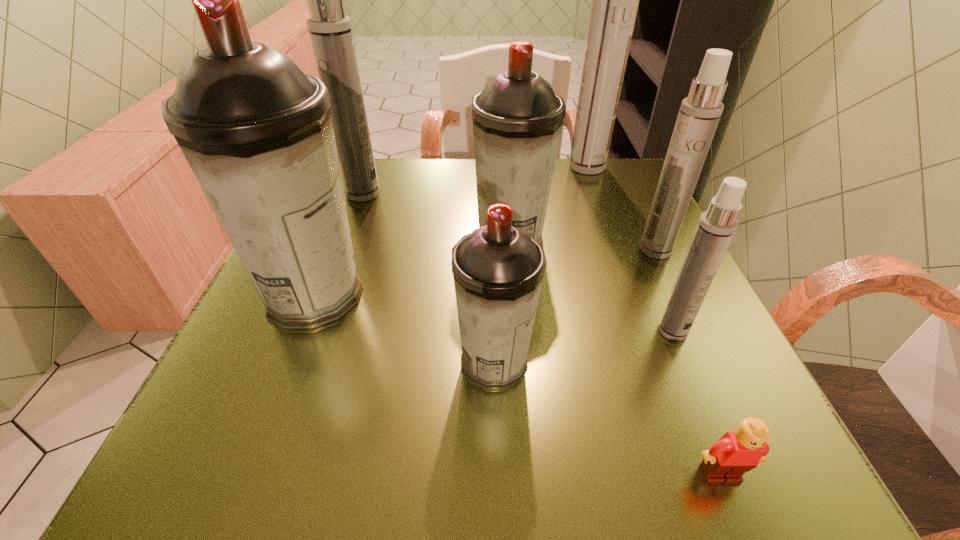
Identify the location of the farthest aerosol can. (615, 0).

Identify the location of the farthest white aerosol can. This screenshot has width=960, height=540. (615, 0).

Find the location of a particular element. the sixth nearest aerosol can is located at coordinates (330, 30).

Identify the location of the second farthest white aerosol can. Image resolution: width=960 pixels, height=540 pixels. (330, 30).

The width and height of the screenshot is (960, 540). Identify the location of the biggest gray aerosol can. (257, 132).

Locate an element on the screen. This screenshot has height=540, width=960. the second smallest white aerosol can is located at coordinates (699, 114).

Locate an element on the screen. The height and width of the screenshot is (540, 960). the second biggest gray aerosol can is located at coordinates (517, 118).

Locate an element on the screen. The height and width of the screenshot is (540, 960). the smallest white aerosol can is located at coordinates (716, 227).

What are the coordinates of `the smallest gray aerosol can` in the screenshot? It's located at (498, 269).

The height and width of the screenshot is (540, 960). Identify the location of Lego. (736, 452).